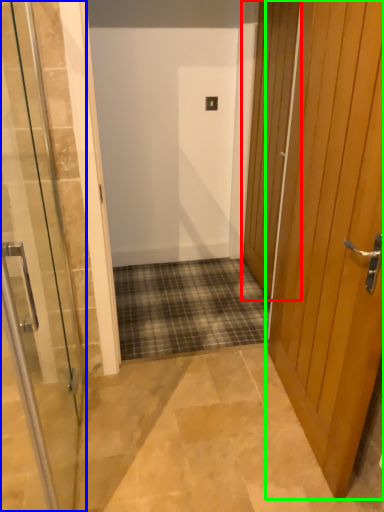
Question: Which object is the closest to the door (highlighted by a red box)? Choose among these: door (highlighted by a blue box) or door (highlighted by a green box).

Choices:
 (A) door
 (B) door

Answer: (B)